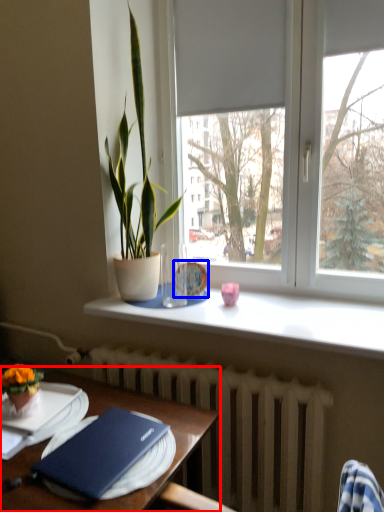
Question: Among these objects, which one is nearest to the camera, table (highlighted by a red box) or tableware (highlighted by a blue box)?

Choices:
 (A) table
 (B) tableware

Answer: (A)